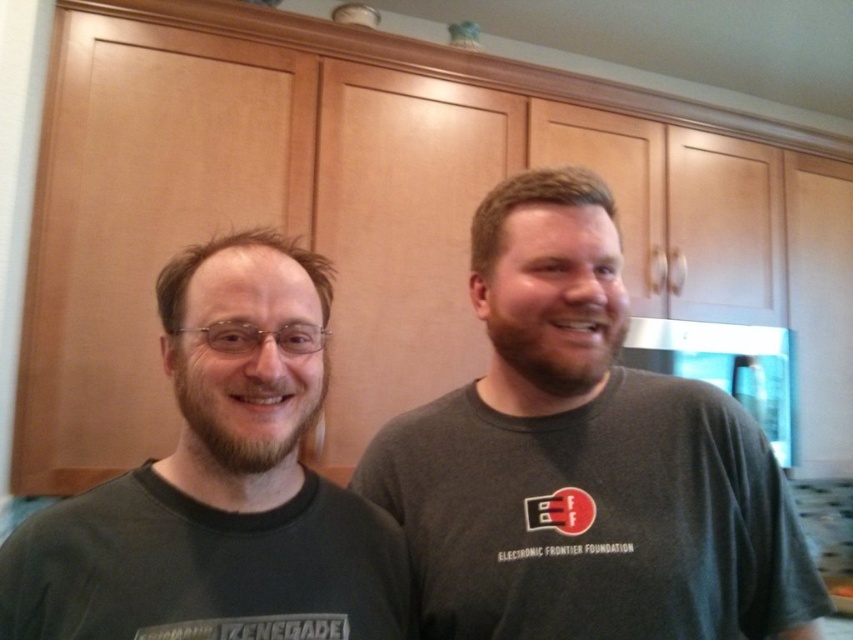
Does dark gray t-shirt at right appear on the right side of dark gray t-shirt at left?

Correct, you'll find dark gray t-shirt at right to the right of dark gray t-shirt at left.

Can you confirm if dark gray t-shirt at right is shorter than dark gray t-shirt at left?

Incorrect, dark gray t-shirt at right's height does not fall short of dark gray t-shirt at left's.

Which is in front, point (616, 296) or point (28, 548)?

Point (28, 548) is in front.

Locate an element on the screen. The width and height of the screenshot is (853, 640). dark gray t-shirt at right is located at coordinates (583, 460).